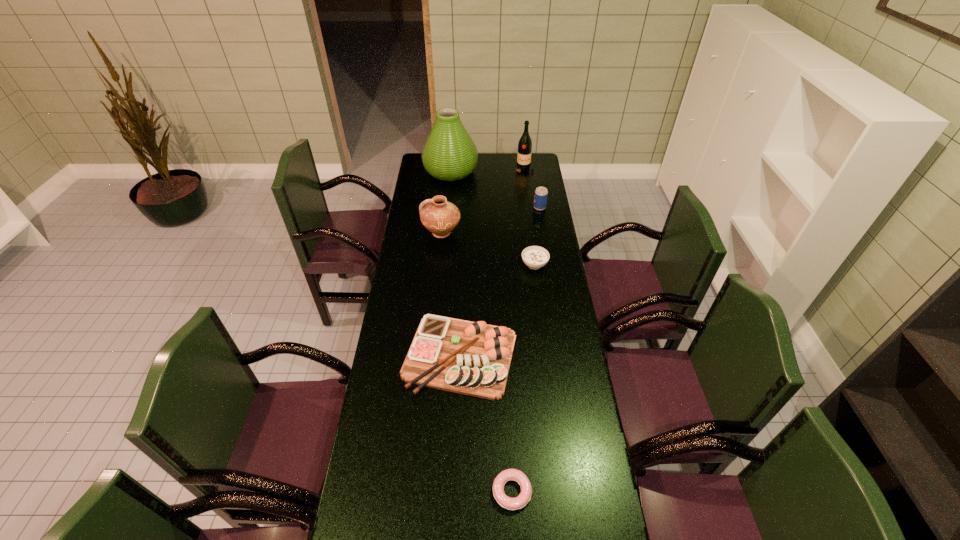
You are a GUI agent. You are given a task and a screenshot of the screen. Output one action in this format:
    pyautogui.click(x=<x>, y=<y>)
    Task: Click on the tallest object
    This screenshot has height=540, width=960.
    Given the screenshot: What is the action you would take?
    pyautogui.click(x=449, y=154)

Where is `the sixth shortest object`? The image size is (960, 540). the sixth shortest object is located at coordinates (525, 143).

Where is `the fifth shortest object`? The width and height of the screenshot is (960, 540). the fifth shortest object is located at coordinates (439, 216).

Find the location of a particular element. the fourth nearest object is located at coordinates (439, 216).

This screenshot has height=540, width=960. Identify the location of the third farthest object. (540, 199).

You are a GUI agent. You are given a task and a screenshot of the screen. Output one action in this format:
    pyautogui.click(x=<x>, y=<y>)
    Task: Click on the fourth shortest object
    Image resolution: width=960 pixels, height=540 pixels.
    Given the screenshot: What is the action you would take?
    pyautogui.click(x=540, y=199)

Image resolution: width=960 pixels, height=540 pixels. Identify the location of the sixth farthest object. (472, 358).

Identify the location of platter. (472, 358).

Locate an element on the screen. The height and width of the screenshot is (540, 960). the fifth farthest object is located at coordinates (535, 257).

Identify the location of soup bowl. The image size is (960, 540). (535, 257).